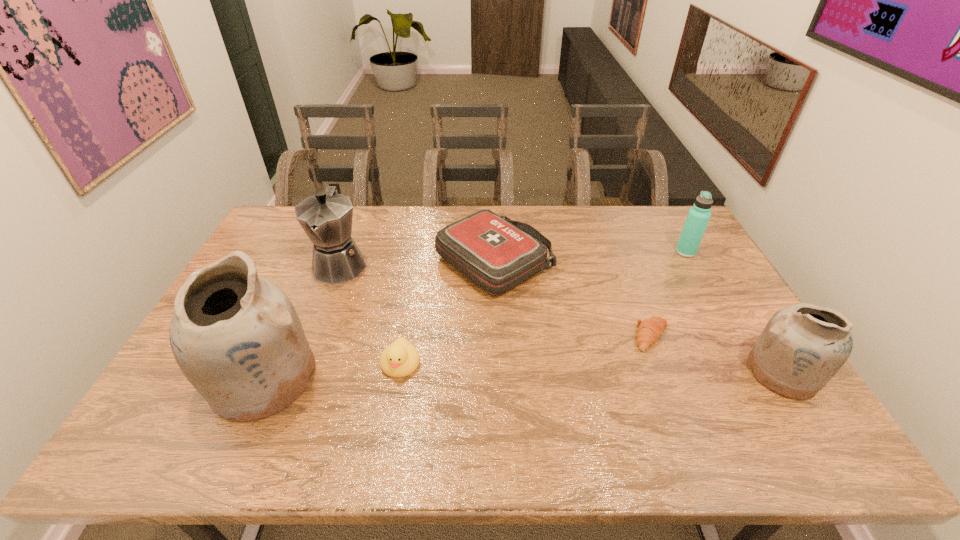
In order to click on duckling present at the near edge in this screenshot , I will do `click(400, 359)`.

This screenshot has height=540, width=960. I want to click on object that is at the left edge, so click(237, 338).

Identify the location of pottery at the right edge. coord(803,346).

The width and height of the screenshot is (960, 540). What are the coordinates of `thermos bottle located in the right edge section of the desktop` in the screenshot? It's located at (698, 216).

Locate an element on the screen. The height and width of the screenshot is (540, 960). object that is at the near left corner is located at coordinates (237, 338).

Identify the location of object that is positioned at the near right corner. Image resolution: width=960 pixels, height=540 pixels. (803, 346).

I want to click on free space at the far edge, so click(491, 206).

You are a GUI agent. You are given a task and a screenshot of the screen. Output one action in this format:
    pyautogui.click(x=<x>, y=<y>)
    Task: Click on the vacant area at the near edge of the desktop
    
    Given the screenshot: What is the action you would take?
    pyautogui.click(x=395, y=399)

Identify the location of vacant space at the left edge. (288, 252).

The height and width of the screenshot is (540, 960). What are the coordinates of `vacant area that lies between the shortest object and the tallest object` in the screenshot? It's located at (458, 357).